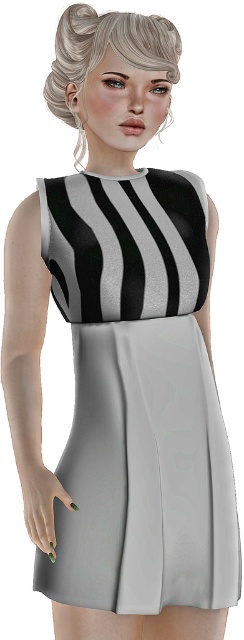
Question: Can you confirm if blonde hair at upper center is wider than green matte nails at lower left?

Choices:
 (A) no
 (B) yes

Answer: (B)

Question: In this image, where is blonde hair at upper center located relative to green matte nails at lower left?

Choices:
 (A) left
 (B) right

Answer: (B)

Question: Which point appears farthest from the camera in this image?

Choices:
 (A) (30, 488)
 (B) (122, 58)

Answer: (A)

Question: Which of the following is the closest to the observer?

Choices:
 (A) green matte nails at lower left
 (B) blonde hair at upper center

Answer: (B)

Question: In this image, where is blonde hair at upper center located relative to green matte nails at lower left?

Choices:
 (A) above
 (B) below

Answer: (A)